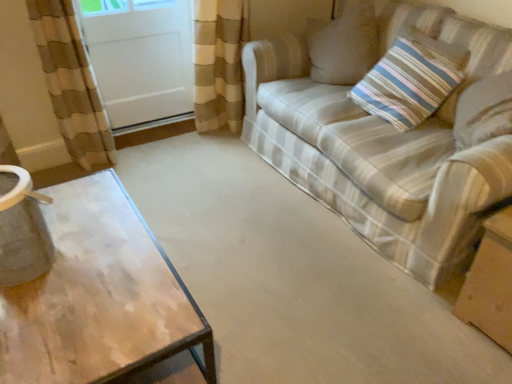
Where is `vacant region in front of white glossy screen door at upper left`? Image resolution: width=512 pixels, height=384 pixels. vacant region in front of white glossy screen door at upper left is located at coordinates (156, 161).